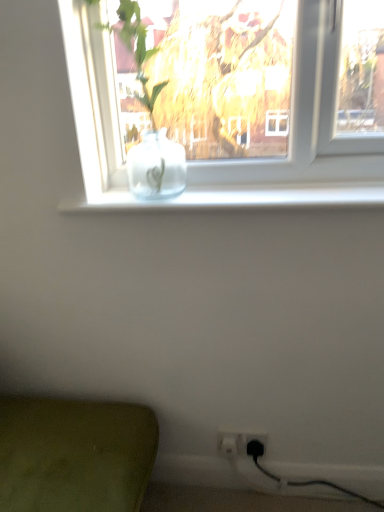
Question: Considering the relative positions of white plastic electric outlet at lower right, which is the second electric outlet in left-to-right order, and white plastic electric outlet at lower right, arranged as the 1th electric outlet when viewed from the left, in the image provided, is white plastic electric outlet at lower right, which is the second electric outlet in left-to-right order, to the left of white plastic electric outlet at lower right, arranged as the 1th electric outlet when viewed from the left, from the viewer's perspective?

Choices:
 (A) no
 (B) yes

Answer: (A)

Question: From the image's perspective, is white plastic electric outlet at lower right, marked as the 1th electric outlet in a right-to-left arrangement, over white plastic electric outlet at lower right, arranged as the 1th electric outlet when viewed from the left?

Choices:
 (A) no
 (B) yes

Answer: (A)

Question: Can you confirm if white plastic electric outlet at lower right, marked as the 1th electric outlet in a right-to-left arrangement, is bigger than white plastic electric outlet at lower right, arranged as the 1th electric outlet when viewed from the left?

Choices:
 (A) no
 (B) yes

Answer: (A)

Question: From a real-world perspective, does white plastic electric outlet at lower right, marked as the 1th electric outlet in a right-to-left arrangement, sit lower than white plastic electric outlet at lower right, which appears as the second electric outlet when viewed from the right?

Choices:
 (A) yes
 (B) no

Answer: (A)

Question: Considering the relative sizes of white plastic electric outlet at lower right, marked as the 1th electric outlet in a right-to-left arrangement, and white plastic electric outlet at lower right, arranged as the 1th electric outlet when viewed from the left, in the image provided, is white plastic electric outlet at lower right, marked as the 1th electric outlet in a right-to-left arrangement, thinner than white plastic electric outlet at lower right, arranged as the 1th electric outlet when viewed from the left,?

Choices:
 (A) yes
 (B) no

Answer: (B)

Question: From a real-world perspective, does white plastic electric outlet at lower right, marked as the 1th electric outlet in a right-to-left arrangement, stand above white plastic electric outlet at lower right, arranged as the 1th electric outlet when viewed from the left?

Choices:
 (A) yes
 (B) no

Answer: (B)

Question: From a real-world perspective, is white plastic electric outlet at lower right, which appears as the second electric outlet when viewed from the right, under white plastic electric outlet at lower right, marked as the 1th electric outlet in a right-to-left arrangement?

Choices:
 (A) yes
 (B) no

Answer: (B)

Question: Is white plastic electric outlet at lower right, which appears as the second electric outlet when viewed from the right, positioned with its back to white plastic electric outlet at lower right, which is the second electric outlet in left-to-right order?

Choices:
 (A) no
 (B) yes

Answer: (B)

Question: Would you say white plastic electric outlet at lower right, arranged as the 1th electric outlet when viewed from the left, is a long distance from white plastic electric outlet at lower right, which is the second electric outlet in left-to-right order?

Choices:
 (A) no
 (B) yes

Answer: (A)

Question: Can you confirm if white plastic electric outlet at lower right, arranged as the 1th electric outlet when viewed from the left, is shorter than white plastic electric outlet at lower right, which is the second electric outlet in left-to-right order?

Choices:
 (A) yes
 (B) no

Answer: (B)

Question: Considering the relative sizes of white plastic electric outlet at lower right, which appears as the second electric outlet when viewed from the right, and white plastic electric outlet at lower right, which is the second electric outlet in left-to-right order, in the image provided, is white plastic electric outlet at lower right, which appears as the second electric outlet when viewed from the right, wider than white plastic electric outlet at lower right, which is the second electric outlet in left-to-right order,?

Choices:
 (A) yes
 (B) no

Answer: (B)

Question: Does white plastic electric outlet at lower right, which appears as the second electric outlet when viewed from the right, have a lesser width compared to white plastic electric outlet at lower right, which is the second electric outlet in left-to-right order?

Choices:
 (A) no
 (B) yes

Answer: (B)

Question: In terms of width, does white plastic electric outlet at lower right, which appears as the second electric outlet when viewed from the right, look wider or thinner when compared to white plastic electric outlet at lower right, which is the second electric outlet in left-to-right order?

Choices:
 (A) thin
 (B) wide

Answer: (A)